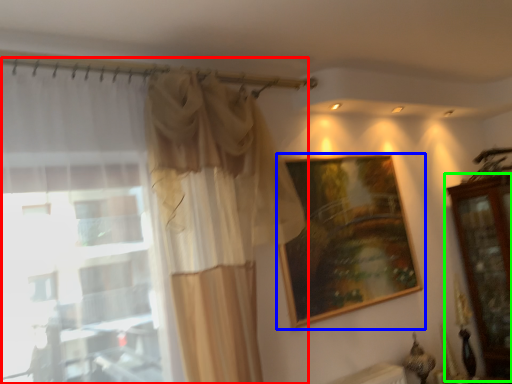
Question: Based on their relative distances, which object is farther from curtain (highlighted by a red box)? Choose from picture frame (highlighted by a blue box) and dresser (highlighted by a green box).

Choices:
 (A) picture frame
 (B) dresser

Answer: (B)